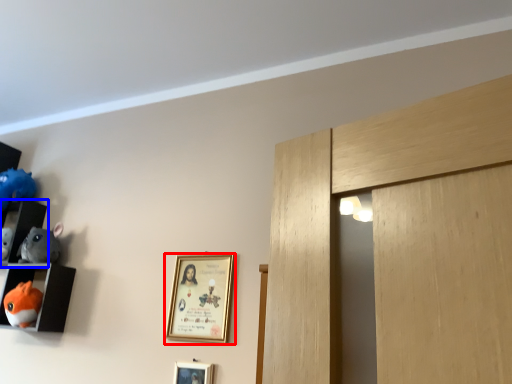
Question: Among these objects, which one is farthest to the camera, picture frame (highlighted by a red box) or shelf (highlighted by a blue box)?

Choices:
 (A) picture frame
 (B) shelf

Answer: (B)